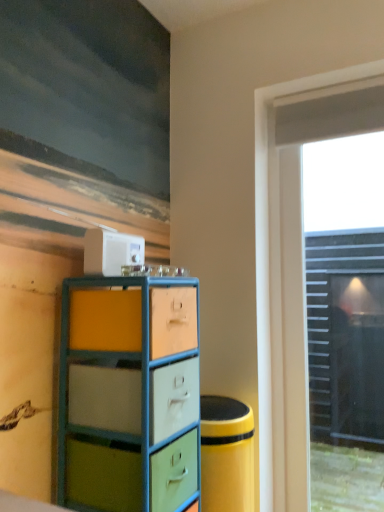
Question: Does transparent glass door at right have a greater width compared to white plastic toaster at upper center?

Choices:
 (A) no
 (B) yes

Answer: (B)

Question: Considering the relative sizes of transparent glass door at right and white plastic toaster at upper center in the image provided, is transparent glass door at right shorter than white plastic toaster at upper center?

Choices:
 (A) yes
 (B) no

Answer: (B)

Question: Is transparent glass door at right facing away from white plastic toaster at upper center?

Choices:
 (A) yes
 (B) no

Answer: (B)

Question: Is transparent glass door at right outside of white plastic toaster at upper center?

Choices:
 (A) no
 (B) yes

Answer: (B)

Question: From the image's perspective, is transparent glass door at right located beneath white plastic toaster at upper center?

Choices:
 (A) yes
 (B) no

Answer: (A)

Question: Based on their sizes in the image, would you say white plastic toaster at upper center is bigger or smaller than matte painted wood chest of drawers at center?

Choices:
 (A) big
 (B) small

Answer: (B)

Question: From the image's perspective, relative to matte painted wood chest of drawers at center, is white plastic toaster at upper center above or below?

Choices:
 (A) below
 (B) above

Answer: (B)

Question: Is white plastic toaster at upper center wider or thinner than matte painted wood chest of drawers at center?

Choices:
 (A) wide
 (B) thin

Answer: (B)

Question: From a real-world perspective, is white plastic toaster at upper center positioned above or below matte painted wood chest of drawers at center?

Choices:
 (A) above
 (B) below

Answer: (A)

Question: Is matte painted wood chest of drawers at center to the left or to the right of white plastic toaster at upper center in the image?

Choices:
 (A) left
 (B) right

Answer: (B)

Question: From the image's perspective, is matte painted wood chest of drawers at center positioned above or below white plastic toaster at upper center?

Choices:
 (A) above
 (B) below

Answer: (B)

Question: From a real-world perspective, is matte painted wood chest of drawers at center above or below white plastic toaster at upper center?

Choices:
 (A) above
 (B) below

Answer: (B)

Question: Does point (114, 300) appear closer or farther from the camera than point (109, 240)?

Choices:
 (A) closer
 (B) farther

Answer: (A)

Question: Considering the relative positions of matte painted wood chest of drawers at center and transparent glass door at right in the image provided, is matte painted wood chest of drawers at center to the left or to the right of transparent glass door at right?

Choices:
 (A) left
 (B) right

Answer: (A)

Question: Considering the positions of point (175, 415) and point (319, 96), is point (175, 415) closer or farther from the camera than point (319, 96)?

Choices:
 (A) closer
 (B) farther

Answer: (A)